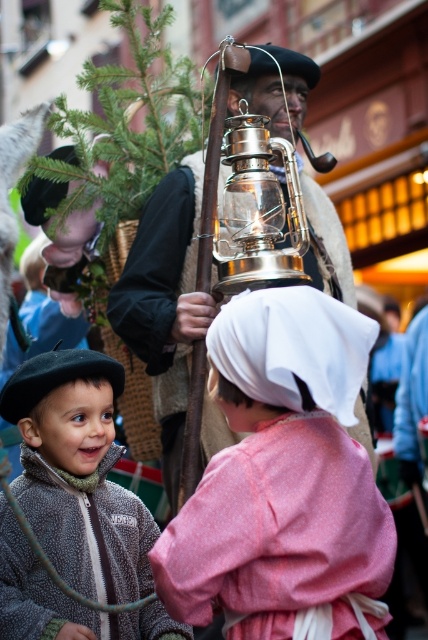
Consider the image. Does pink fabric dress at center appear on the right side of fuzzy gray jacket at lower left?

Correct, you'll find pink fabric dress at center to the right of fuzzy gray jacket at lower left.

Does point (327, 369) lie in front of point (152, 612)?

Yes, point (327, 369) is closer to viewer.

This screenshot has height=640, width=428. Find the location of `pink fabric dress at center`. pink fabric dress at center is located at coordinates (282, 476).

Is fuzzy gray jacket at lower left above shiny brass oil lamp at center?

No, fuzzy gray jacket at lower left is not above shiny brass oil lamp at center.

You are a GUI agent. You are given a task and a screenshot of the screen. Output one action in this format:
    pyautogui.click(x=<x>, y=<y>)
    Task: Click on the fuzzy gray jacket at lower left
    The width and height of the screenshot is (428, 640).
    Given the screenshot: What is the action you would take?
    pyautogui.click(x=77, y=474)

Is shiny brass lantern at center shorter than shiny brass oil lamp at center?

In fact, shiny brass lantern at center may be taller than shiny brass oil lamp at center.

Is point (149, 280) less distant than point (276, 253)?

No, (149, 280) is further to viewer.

Describe the element at coordinates (166, 304) in the screenshot. The image size is (428, 640). I see `shiny brass lantern at center` at that location.

The height and width of the screenshot is (640, 428). In order to click on shiny brass lantern at center in this screenshot , I will do `click(166, 304)`.